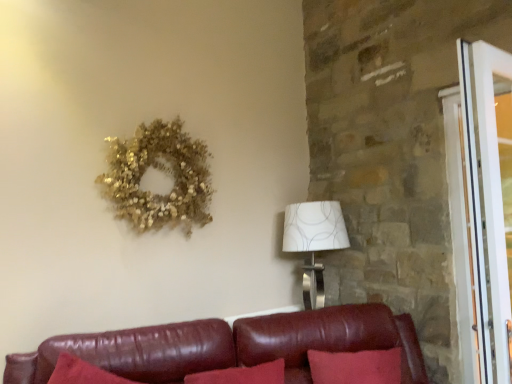
Question: Is leather couch at lower center wider or thinner than gold glittery wreath at upper left?

Choices:
 (A) wide
 (B) thin

Answer: (A)

Question: Would you say leather couch at lower center is inside or outside gold glittery wreath at upper left?

Choices:
 (A) outside
 (B) inside

Answer: (A)

Question: Which object is positioned farthest from the white textured lampshade at right?

Choices:
 (A) white glossy screen door at right
 (B) gold glittery wreath at upper left
 (C) leather couch at lower center

Answer: (A)

Question: Based on their relative distances, which object is farther from the white textured lampshade at right?

Choices:
 (A) gold glittery wreath at upper left
 (B) white glossy screen door at right
 (C) leather couch at lower center

Answer: (B)